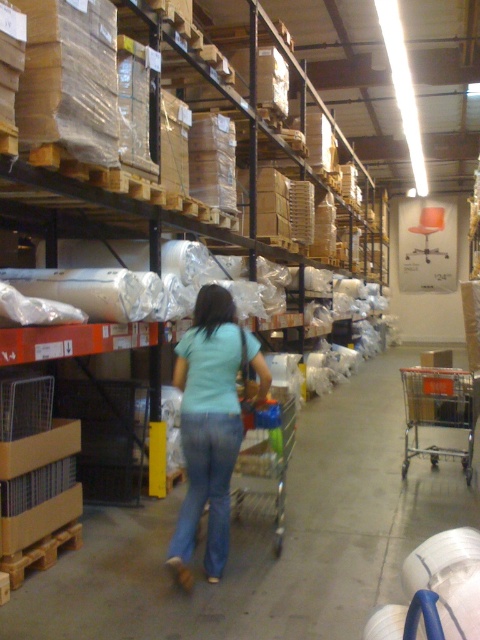
Question: Which object appears closest to the camera in this image?

Choices:
 (A) metallic silver trolley at center-right
 (B) metallic silver trolley at center

Answer: (B)

Question: Is light blue denim jeans at center positioned before blue denim jeans at center?

Choices:
 (A) no
 (B) yes

Answer: (A)

Question: Which of the following is the closest to the observer?

Choices:
 (A) tap(274, 506)
 (B) tap(224, 321)
 (C) tap(436, 392)
 (D) tap(206, 576)

Answer: (D)

Question: Can you confirm if metallic silver trolley at center is positioned above metallic silver trolley at center-right?

Choices:
 (A) no
 (B) yes

Answer: (B)

Question: Which object appears closest to the camera in this image?

Choices:
 (A) light blue denim jeans at center
 (B) metallic silver trolley at center
 (C) blue denim jeans at center
 (D) metallic silver trolley at center-right

Answer: (C)

Question: Does blue denim jeans at center have a larger size compared to metallic silver trolley at center-right?

Choices:
 (A) no
 (B) yes

Answer: (A)